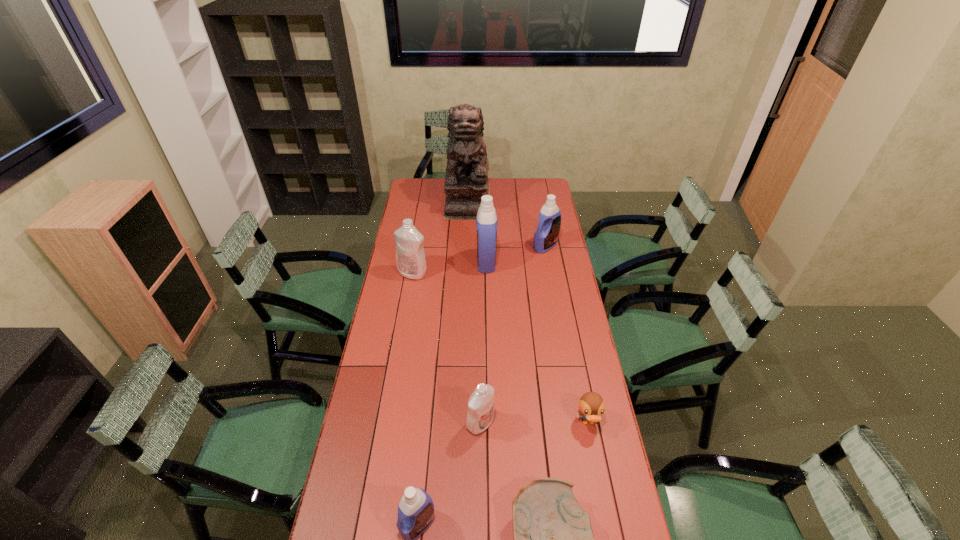
Image resolution: width=960 pixels, height=540 pixels. What are the coordinates of `free area in between the leftmost object and the second blue detergent from right to left` in the screenshot? It's located at (449, 268).

Image resolution: width=960 pixels, height=540 pixels. What are the coordinates of `object that is the closest to the smaller white detergent` in the screenshot? It's located at (553, 539).

Choose which object is the seventh nearest neighbor to the leftmost detergent. Please provide its 2D coordinates. Your answer should be formatted as a tuple, i.e. [(x, y)], where the tuple contains the x and y coordinates of a point satisfying the conditions above.

[(553, 539)]

Locate which detergent is the fifth closest to the tallest object. Please provide its 2D coordinates. Your answer should be formatted as a tuple, i.e. [(x, y)], where the tuple contains the x and y coordinates of a point satisfying the conditions above.

[(416, 508)]

Identify the location of detergent object that ranks as the closest to the bigger white detergent. (486, 220).

Identify which blue detergent is the nearest to the rightmost detergent. Please provide its 2D coordinates. Your answer should be formatted as a tuple, i.e. [(x, y)], where the tuple contains the x and y coordinates of a point satisfying the conditions above.

[(486, 220)]

Point out which blue detergent is positioned as the nearest to the rightmost detergent. Please provide its 2D coordinates. Your answer should be formatted as a tuple, i.e. [(x, y)], where the tuple contains the x and y coordinates of a point satisfying the conditions above.

[(486, 220)]

The width and height of the screenshot is (960, 540). Identify the location of free space that satisfies the following two spatial constraints: 1. on the back side of the second biggest blue detergent; 2. on the left side of the seventh shortest object. (486, 246).